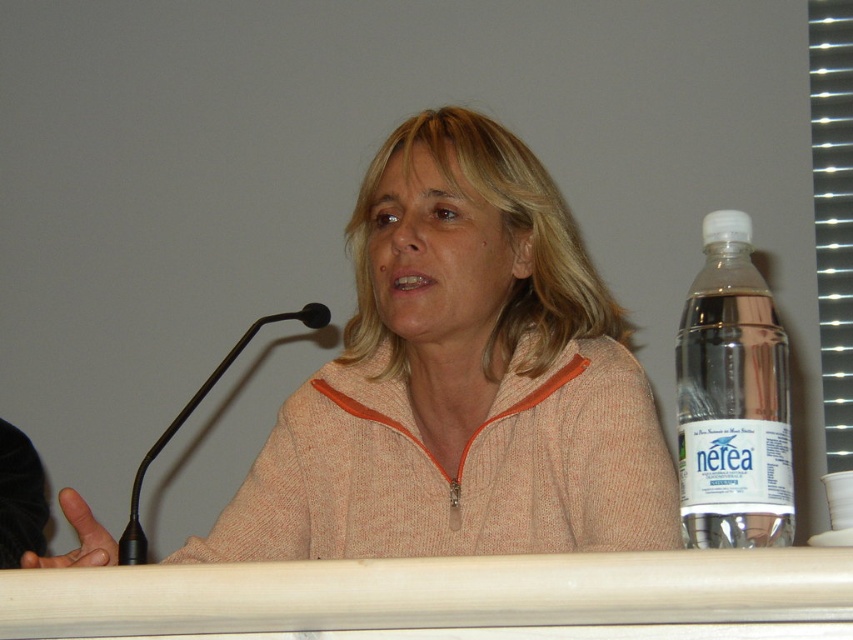
Question: Does white wood table at center come in front of clear plastic bottle at right?

Choices:
 (A) no
 (B) yes

Answer: (B)

Question: Is orange knit sweater at center thinner than black plastic microphone at left?

Choices:
 (A) yes
 (B) no

Answer: (B)

Question: Which of the following is the closest to the observer?

Choices:
 (A) black plastic microphone at left
 (B) clear plastic bottle at right

Answer: (B)

Question: Based on their relative distances, which object is farther from the orange knit sweater at center?

Choices:
 (A) black plastic microphone at left
 (B) clear plastic bottle at right
 (C) white wood table at center

Answer: (C)

Question: Is white wood table at center to the left of black plastic microphone at left from the viewer's perspective?

Choices:
 (A) no
 (B) yes

Answer: (A)

Question: Estimate the real-world distances between objects in this image. Which object is farther from the black plastic microphone at left?

Choices:
 (A) orange knit sweater at center
 (B) white wood table at center
 (C) clear plastic bottle at right

Answer: (C)